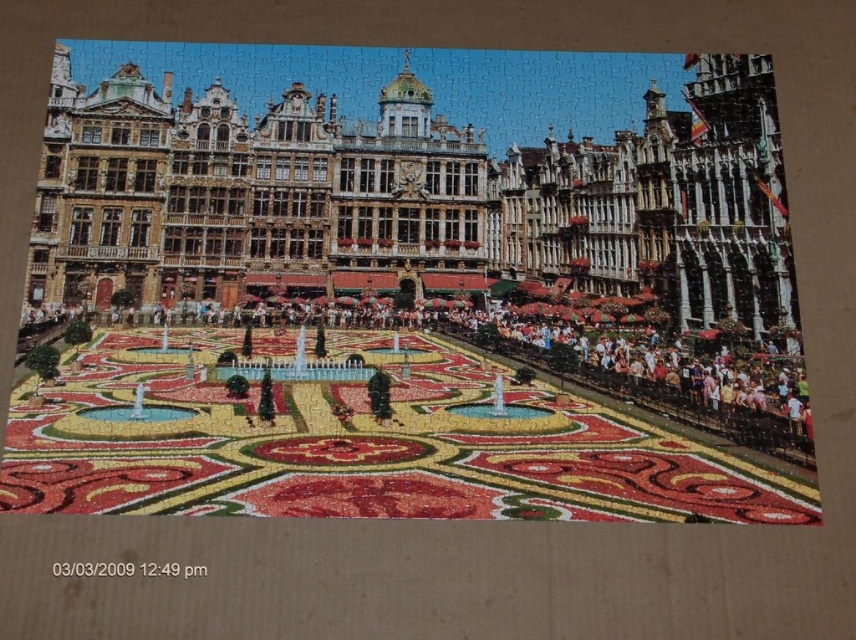
Does golden stone palace at upper center appear on the right side of floral carpet at center?

Yes, golden stone palace at upper center is to the right of floral carpet at center.

Is point (685, 248) less distant than point (609, 456)?

No, (685, 248) is behind (609, 456).

Who is more distant from viewer, (721, 253) or (286, 394)?

The point (721, 253) is behind.

The image size is (856, 640). In order to click on golden stone palace at upper center in this screenshot , I will do `click(411, 198)`.